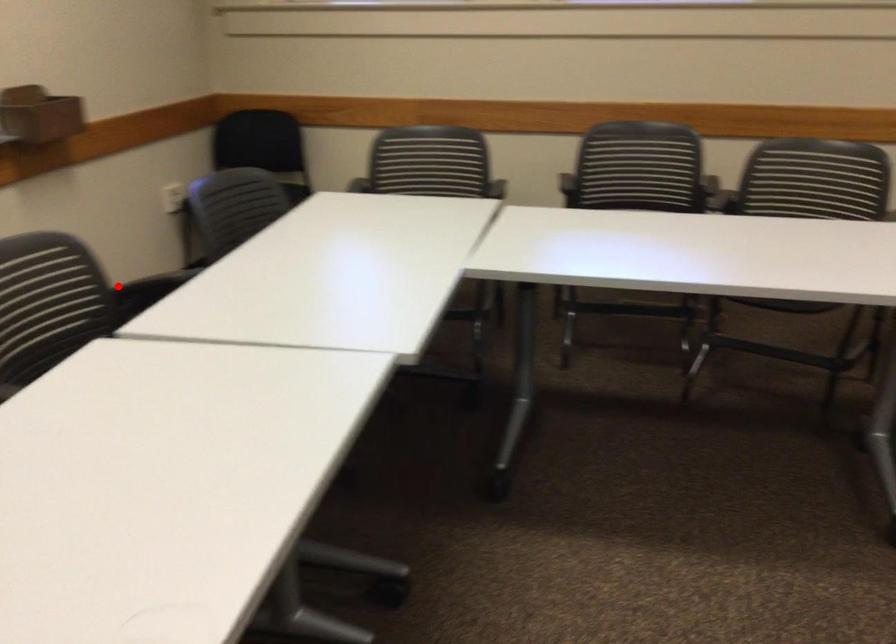
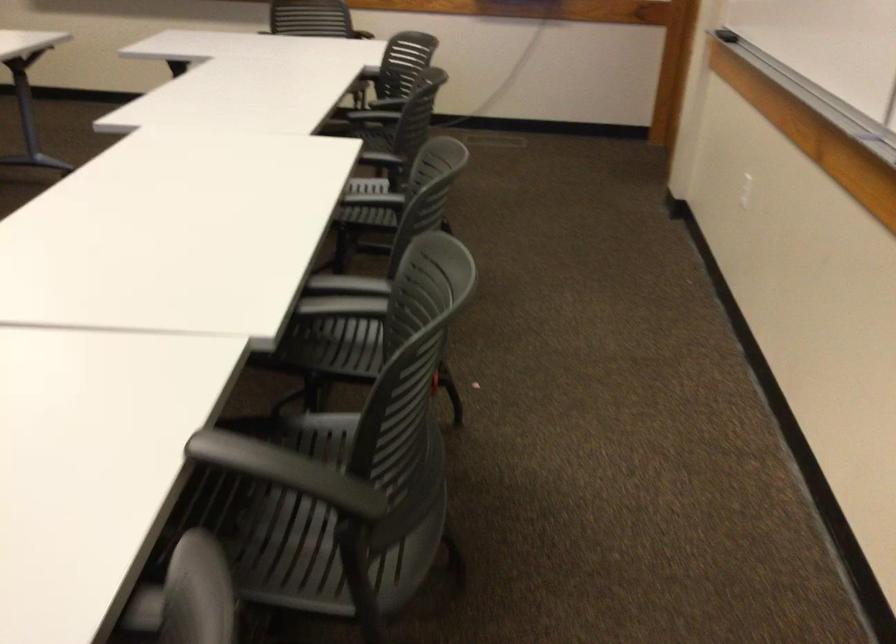
Question: I am providing you with two images of the same scene from different viewpoints. Image1 has a red point marked. In image2, the corresponding 3D location appears at what relative position? Reply with the corresponding letter.

Choices:
 (A) Closer
 (B) Farther

Answer: (A)